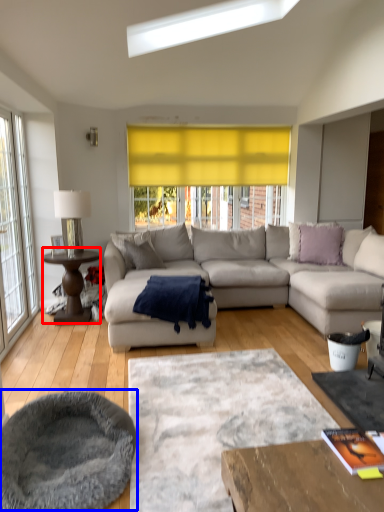
Question: Which of the following is the closest to the observer, coffee table (highlighted by a red box) or cat bed (highlighted by a blue box)?

Choices:
 (A) coffee table
 (B) cat bed

Answer: (B)